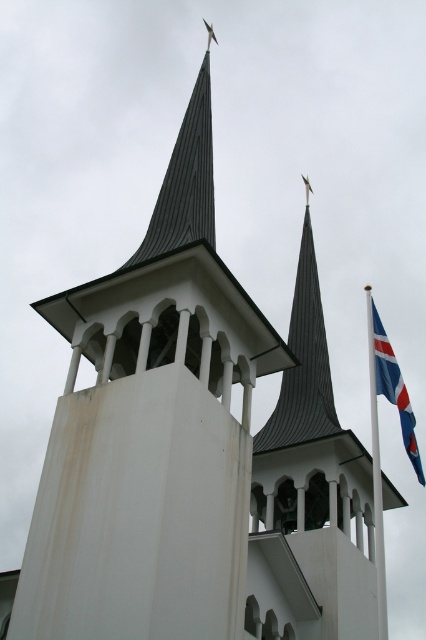
You are standing at the base of the main tower and want to reach the point marked at coordinates point (380, 618). Considering the path leads through the arched openings of the tower, which are spaced 3 meters apart, can you estimate how many arches you would need to pass through to reach the point?

The point (380, 618) is 29.08 meters away from the viewer. Since the arches are spaced 3 meters apart, dividing the total distance by the spacing gives approximately 9.7, so you would need to pass through 10 arches to reach the point.

You are standing in front of the church and want to take a photo of the white metallic flag pole at right and the blue and white fabric flag at right. If you want to capture both objects in the frame, which one should you focus on to ensure both are visible?

You should focus on the white metallic flag pole at right because it is bigger than the blue and white fabric flag at right, so keeping it centered will likely include the smaller flag in the frame as well.

You are standing in front of the church and want to take a photo of both the white metallic flag pole at right and the blue and white fabric flag at right. What is the minimum distance you need to move back to ensure both objects are fully visible in your camera frame?

The white metallic flag pole at right and blue and white fabric flag at right are 18.11 feet apart from each other. To capture both in the frame, you need to move back at least 18.11 feet so that the entire distance between them fits within your camera view.